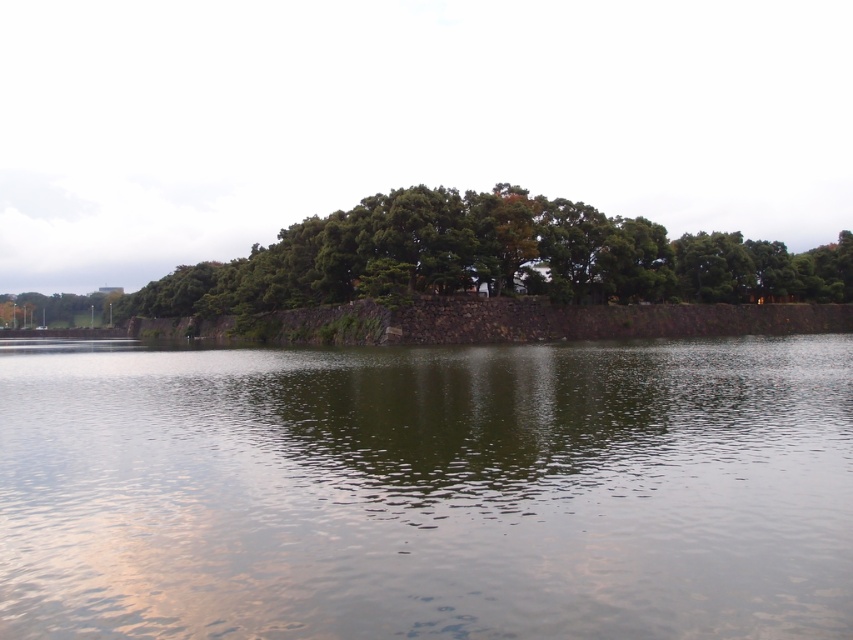
Can you confirm if green reflective water at center is shorter than green leafy tree at center?

Yes, green reflective water at center is shorter than green leafy tree at center.

In the scene shown: Does green reflective water at center have a smaller size compared to green leafy tree at center?

Yes, green reflective water at center is smaller than green leafy tree at center.

The height and width of the screenshot is (640, 853). Describe the element at coordinates (427, 490) in the screenshot. I see `green reflective water at center` at that location.

The width and height of the screenshot is (853, 640). I want to click on green reflective water at center, so click(x=427, y=490).